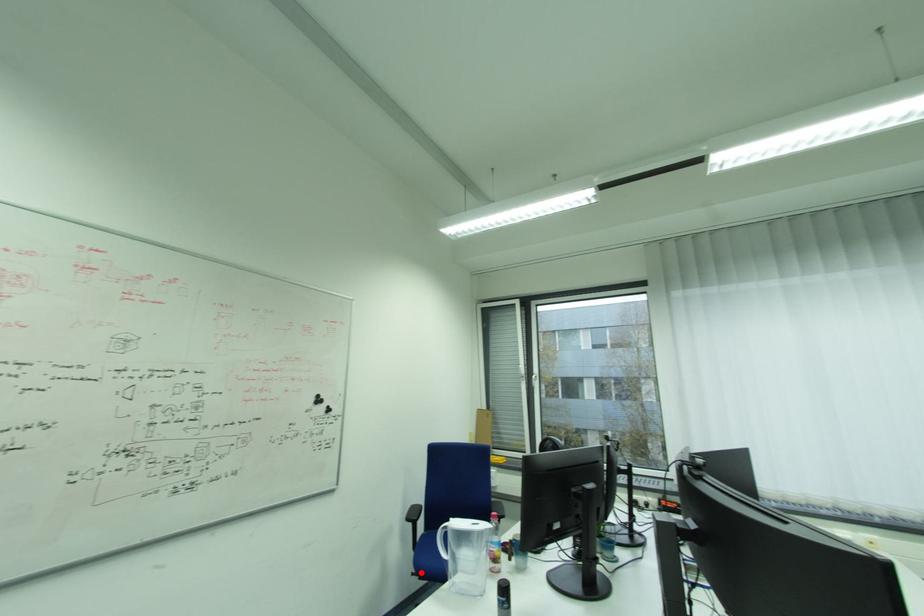
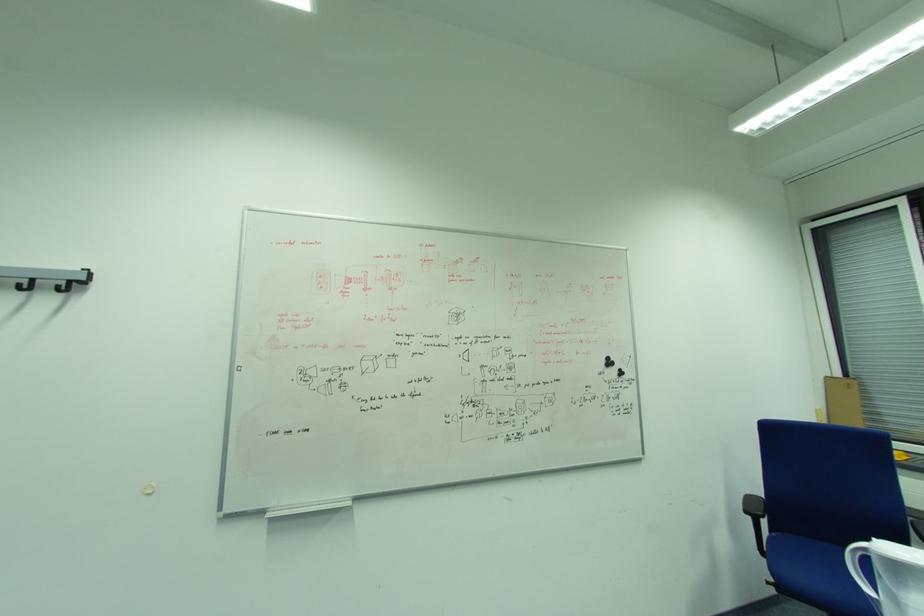
Locate, in the second image, the point that corresponds to the highlighted location in the first image.

(782, 582)